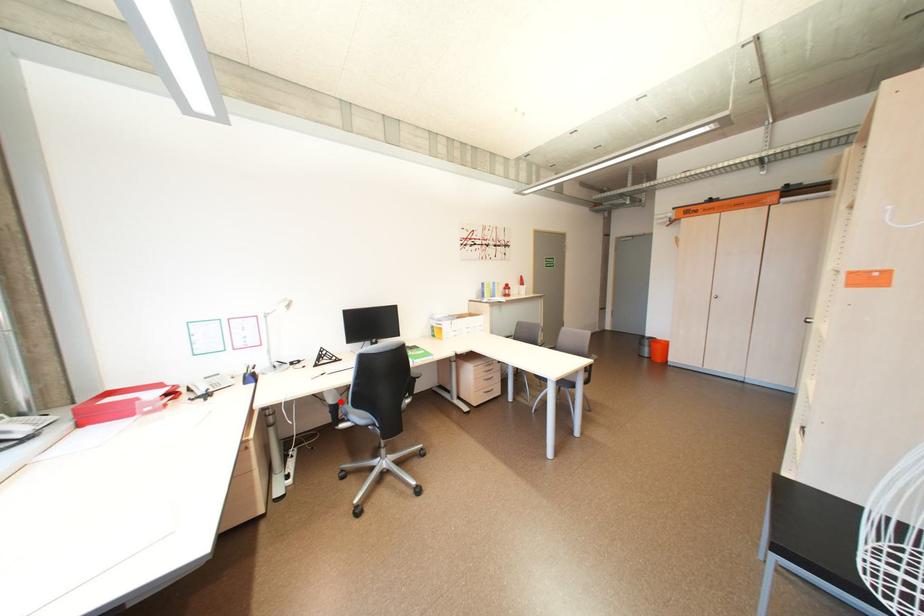
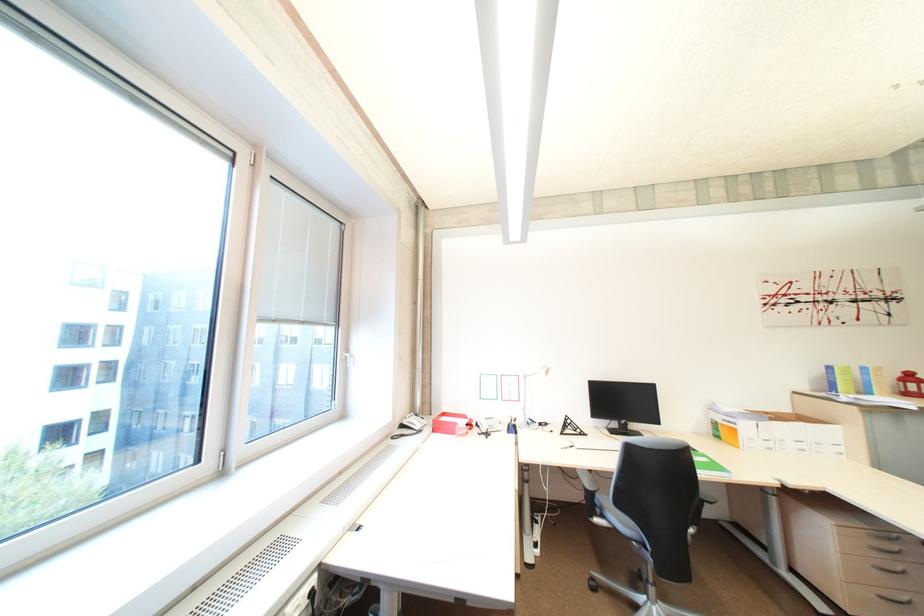
The point at the highlighted location is marked in the first image. Where is the corresponding point in the second image?

(598, 485)